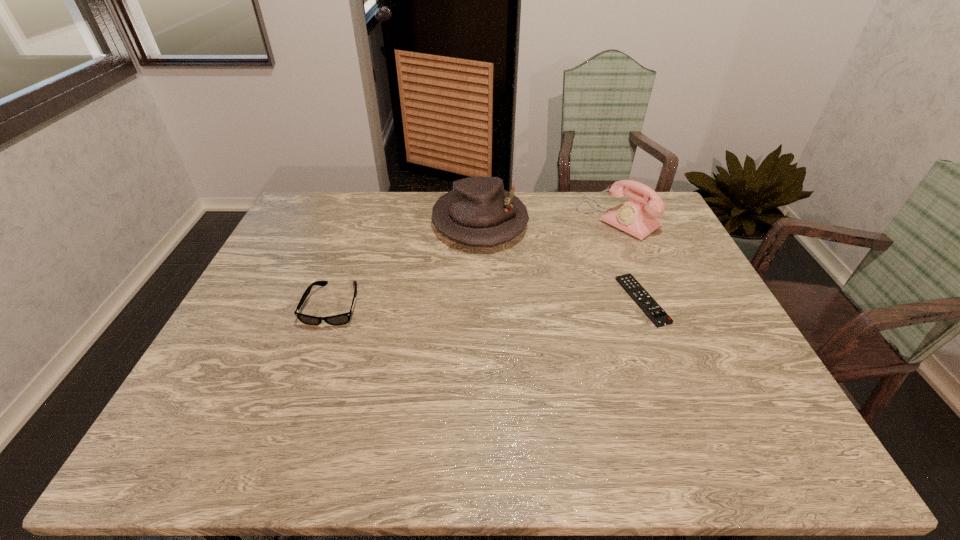
Where is `vacant point at the right edge`? Image resolution: width=960 pixels, height=540 pixels. vacant point at the right edge is located at coordinates (694, 349).

Find the location of `free region at the far left corner`. free region at the far left corner is located at coordinates (339, 213).

This screenshot has width=960, height=540. What are the coordinates of `vacant space at the far right corner of the desktop` in the screenshot? It's located at (671, 225).

What are the coordinates of `vacant space at the near right corner of the desktop` in the screenshot? It's located at (763, 401).

At what (x,y) coordinates should I click in order to perform the action: click on vacant space that's between the sunglasses and the hat. Please return your answer as a coordinate pair (x, y). Looking at the image, I should click on (407, 263).

I want to click on free space between the telephone and the sunglasses, so click(476, 262).

This screenshot has height=540, width=960. I want to click on free point between the leftmost object and the telephone, so click(476, 262).

In order to click on vacant point located between the shortest object and the second object from left to right in this screenshot , I will do `click(561, 261)`.

Identify the location of free space between the sunglasses and the telephone. (476, 262).

Where is `free space between the leftmost object and the hat`? Image resolution: width=960 pixels, height=540 pixels. free space between the leftmost object and the hat is located at coordinates (407, 263).